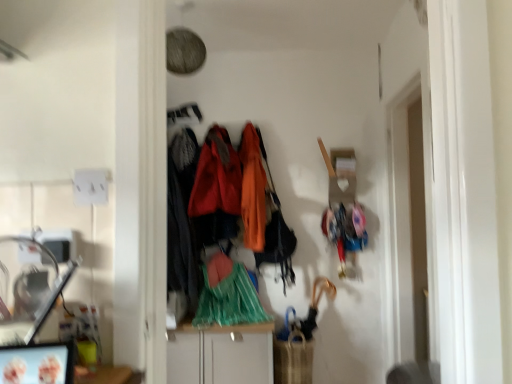
Question: In which direction should I rotate to look at green plastic bag at center, which is the third clothing in left-to-right order?

Choices:
 (A) right
 (B) left

Answer: (B)

Question: Does green plastic bag at center, the second clothing from the right, contain velvet orange coat at center, which ranks as the 3th clothing in right-to-left order?

Choices:
 (A) yes
 (B) no

Answer: (B)

Question: Would you consider green plastic bag at center, the second clothing from the right, to be distant from velvet orange coat at center, which ranks as the 3th clothing in right-to-left order?

Choices:
 (A) yes
 (B) no

Answer: (B)

Question: Does green plastic bag at center, which is the third clothing in left-to-right order, appear on the left side of velvet orange coat at center, which appears as the second clothing when viewed from the left?

Choices:
 (A) no
 (B) yes

Answer: (A)

Question: Considering the relative sizes of green plastic bag at center, which is the third clothing in left-to-right order, and velvet orange coat at center, which appears as the second clothing when viewed from the left, in the image provided, is green plastic bag at center, which is the third clothing in left-to-right order, shorter than velvet orange coat at center, which appears as the second clothing when viewed from the left,?

Choices:
 (A) yes
 (B) no

Answer: (A)

Question: Is green plastic bag at center, which is the third clothing in left-to-right order, taller than velvet orange coat at center, which appears as the second clothing when viewed from the left?

Choices:
 (A) yes
 (B) no

Answer: (B)

Question: Does green plastic bag at center, which is the third clothing in left-to-right order, touch velvet orange coat at center, which appears as the second clothing when viewed from the left?

Choices:
 (A) no
 (B) yes

Answer: (A)

Question: Is velvet orange coat at center, which appears as the second clothing when viewed from the left, taller than white glossy cabinet at center?

Choices:
 (A) no
 (B) yes

Answer: (B)

Question: Would you say velvet orange coat at center, which appears as the second clothing when viewed from the left, contains white glossy cabinet at center?

Choices:
 (A) no
 (B) yes

Answer: (A)

Question: Is velvet orange coat at center, which ranks as the 3th clothing in right-to-left order, bigger than white glossy cabinet at center?

Choices:
 (A) no
 (B) yes

Answer: (A)

Question: From the image's perspective, would you say velvet orange coat at center, which appears as the second clothing when viewed from the left, is positioned over white glossy cabinet at center?

Choices:
 (A) no
 (B) yes

Answer: (B)

Question: From a real-world perspective, is velvet orange coat at center, which appears as the second clothing when viewed from the left, on top of white glossy cabinet at center?

Choices:
 (A) yes
 (B) no

Answer: (A)

Question: Can you confirm if velvet orange coat at center, which ranks as the 3th clothing in right-to-left order, is thinner than white glossy cabinet at center?

Choices:
 (A) yes
 (B) no

Answer: (A)

Question: Would you say green plastic bag at center, which is the third clothing in left-to-right order, is outside white glossy cabinet at center?

Choices:
 (A) no
 (B) yes

Answer: (B)